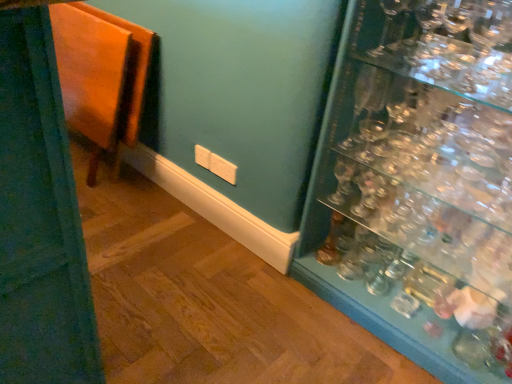
What do you see at coordinates (419, 188) in the screenshot? I see `transparent glass shelves at right` at bounding box center [419, 188].

Where is `wooden folding table at left`? The height and width of the screenshot is (384, 512). wooden folding table at left is located at coordinates (101, 76).

Does transparent glass shelves at right have a greater height compared to wooden folding table at left?

Yes, transparent glass shelves at right is taller than wooden folding table at left.

Is transparent glass shelves at right oriented towards wooden folding table at left?

No, transparent glass shelves at right is not oriented towards wooden folding table at left.

Are transparent glass shelves at right and wooden folding table at left making contact?

No, transparent glass shelves at right is not in contact with wooden folding table at left.

From a real-world perspective, is transparent glass shelves at right physically located above or below wooden folding table at left?

From a real-world perspective, transparent glass shelves at right is physically above wooden folding table at left.

Which point is more forward, (368,141) or (381,55)?

The point (381,55) is closer.

Would you consider transparent glass shelves at right to be distant from clear glass wine glass at upper right?

No, transparent glass shelves at right is not far from clear glass wine glass at upper right.

From a real-world perspective, is transparent glass shelves at right located beneath clear glass wine glass at upper right?

Yes, from a real-world perspective, transparent glass shelves at right is below clear glass wine glass at upper right.

Which object is further away from the camera, transparent glass shelves at right or clear glass wine glass at upper right?

clear glass wine glass at upper right is behind.

Based on the photo, are wooden folding table at left and clear glass wine glass at upper right making contact?

They are not placed beside each other.

Can clear glass wine glass at upper right be found inside wooden folding table at left?

No, clear glass wine glass at upper right is not surrounded by wooden folding table at left.

How far apart are wooden folding table at left and clear glass wine glass at upper right?

The distance of wooden folding table at left from clear glass wine glass at upper right is 1.15 meters.

From the image's perspective, which one is positioned higher, wooden folding table at left or clear glass wine glass at upper right?

Result: clear glass wine glass at upper right, from the image's perspective.

Which is in front, clear glass wine glass at upper right or transparent glass shelves at right?

transparent glass shelves at right.

Is clear glass wine glass at upper right with transparent glass shelves at right?

No, clear glass wine glass at upper right is not touching transparent glass shelves at right.

How many degrees apart are the facing directions of clear glass wine glass at upper right and transparent glass shelves at right?

The angular difference between clear glass wine glass at upper right and transparent glass shelves at right is 0.519 degrees.

Which is correct: clear glass wine glass at upper right is inside transparent glass shelves at right, or outside of it?

clear glass wine glass at upper right lies within the bounds of transparent glass shelves at right.

Can you confirm if wooden folding table at left is shorter than transparent glass shelves at right?

Indeed, wooden folding table at left has a lesser height compared to transparent glass shelves at right.

Considering the points (68, 54) and (504, 164), which point is behind, point (68, 54) or point (504, 164)?

The point (68, 54) is more distant.

Does wooden folding table at left turn towards transparent glass shelves at right?

No, wooden folding table at left is not oriented towards transparent glass shelves at right.

From a real-world perspective, is wooden folding table at left below transparent glass shelves at right?

Yes, from a real-world perspective, wooden folding table at left is under transparent glass shelves at right.

Which is more to the left, clear glass wine glass at upper right or wooden folding table at left?

wooden folding table at left is more to the left.

Considering the relative sizes of clear glass wine glass at upper right and wooden folding table at left in the image provided, is clear glass wine glass at upper right bigger than wooden folding table at left?

Actually, clear glass wine glass at upper right might be smaller than wooden folding table at left.

Find the location of `shelf in front of the wooden folding table at left`. shelf in front of the wooden folding table at left is located at coordinates (419, 188).

Identify the location of shelf directly beneath the clear glass wine glass at upper right (from a real-world perspective). This screenshot has width=512, height=384. (419, 188).

From the image, which object appears to be farther from transparent glass shelves at right, wooden folding table at left or clear glass wine glass at upper right?

wooden folding table at left is positioned further to the anchor transparent glass shelves at right.

Based on their spatial positions, is transparent glass shelves at right or clear glass wine glass at upper right further from wooden folding table at left?

Among the two, clear glass wine glass at upper right is located further to wooden folding table at left.

When comparing their distances from clear glass wine glass at upper right, does wooden folding table at left or transparent glass shelves at right seem closer?

The object closer to clear glass wine glass at upper right is transparent glass shelves at right.

From the image, which object appears to be farther from transparent glass shelves at right, clear glass wine glass at upper right or wooden folding table at left?

wooden folding table at left is positioned further to the anchor transparent glass shelves at right.

Which object lies nearer to the anchor point wooden folding table at left, clear glass wine glass at upper right or transparent glass shelves at right?

transparent glass shelves at right is closer to wooden folding table at left.

Considering their positions, is transparent glass shelves at right positioned closer to clear glass wine glass at upper right than wooden folding table at left?

transparent glass shelves at right.

Locate an element on the screen. wine glass located between wooden folding table at left and transparent glass shelves at right in the left-right direction is located at coordinates (392, 27).